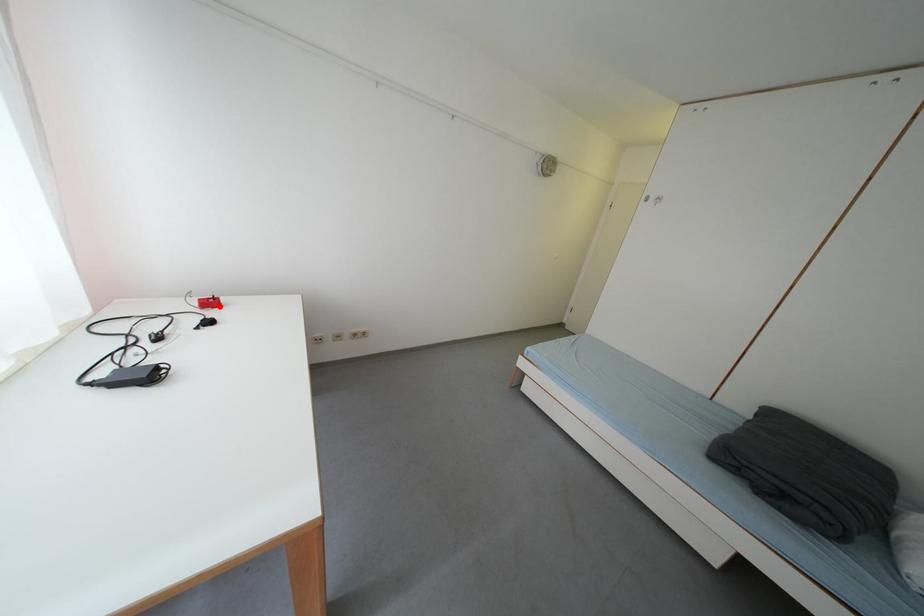
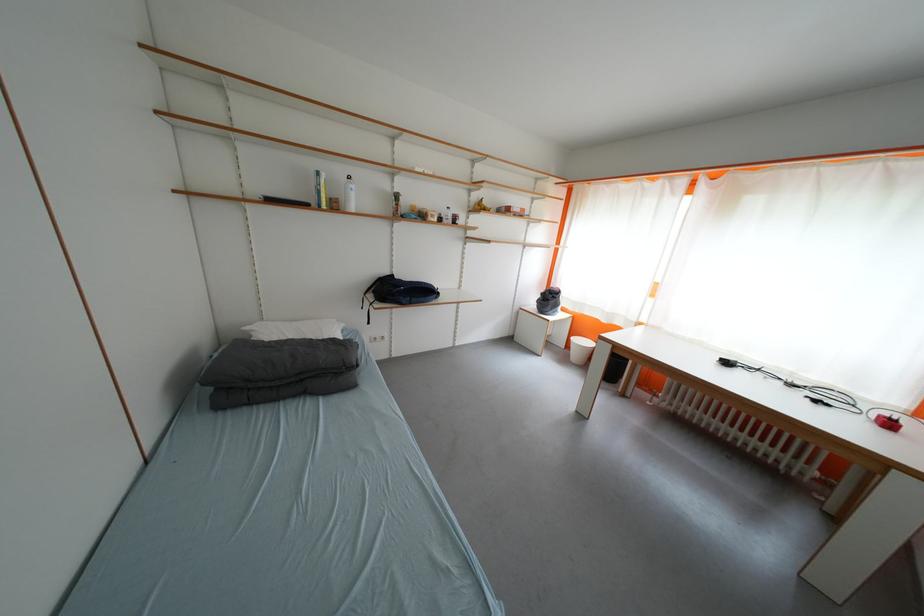
Question: I am providing you with two images of the same scene from different viewpoints. Given a red point in image1, look at the same physical point in image2. Is it:

Choices:
 (A) Closer to the viewpoint
 (B) Farther from the viewpoint

Answer: (A)